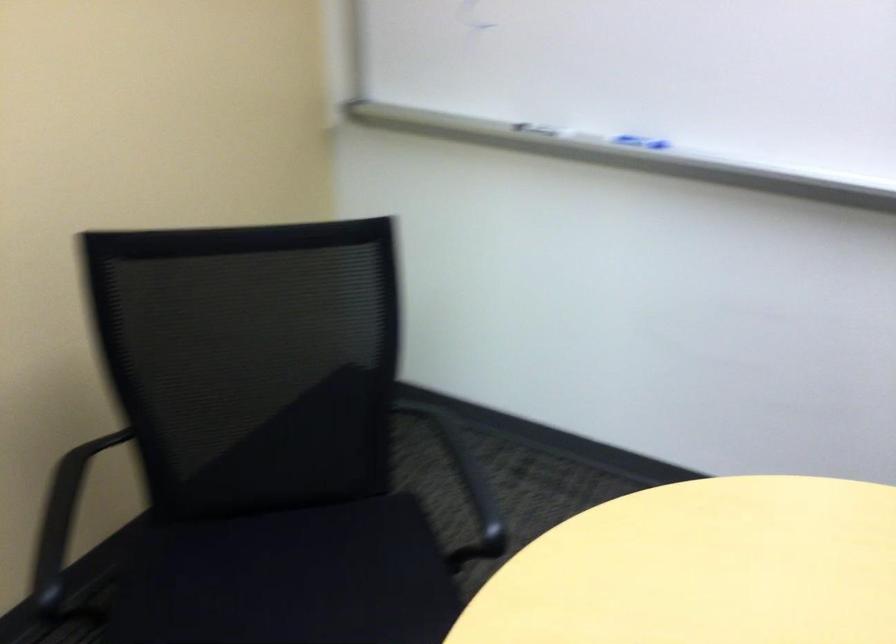
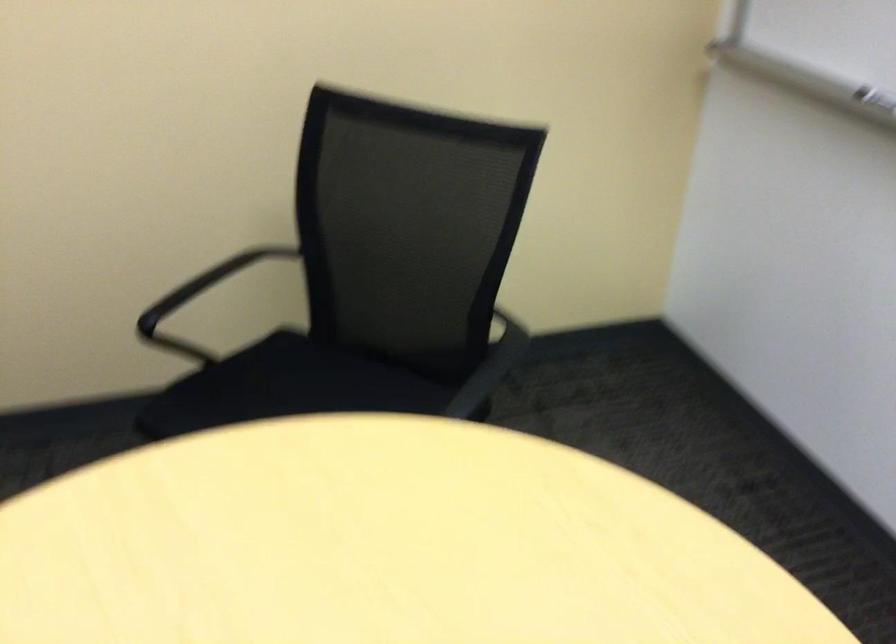
Locate, in the second image, the point that corresponds to [458,453] in the first image.

(489, 368)